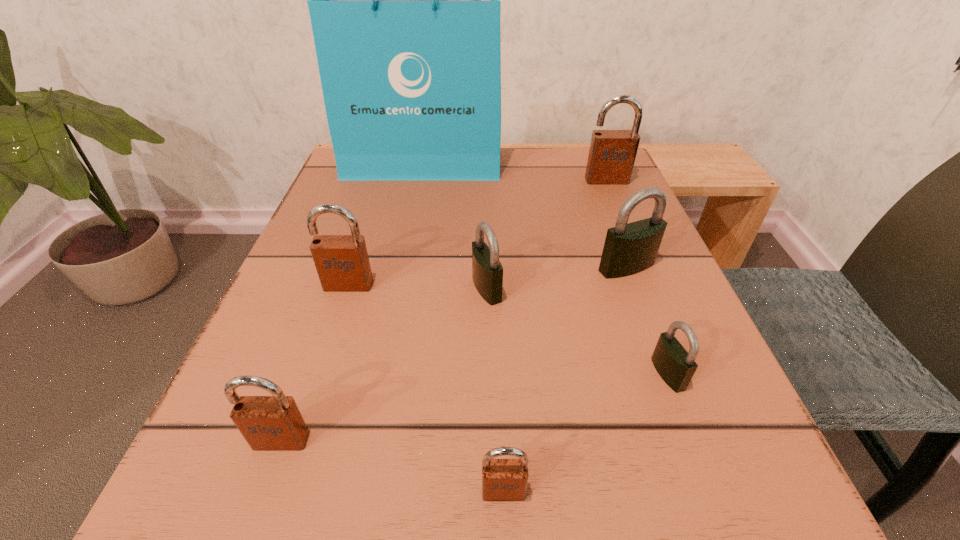
At what (x,y) coordinates should I click in order to perform the action: click on vacant space at the far right corner of the desktop. Please return your answer as a coordinate pair (x, y). Looking at the image, I should click on (563, 169).

In the image, there is a desktop. At what (x,y) coordinates should I click in order to perform the action: click on free space at the near right corner. Please return your answer as a coordinate pair (x, y). The height and width of the screenshot is (540, 960). Looking at the image, I should click on [677, 473].

Find the location of a particular element. vacant region between the nearest object and the seventh farthest object is located at coordinates (393, 465).

I want to click on unoccupied area between the third nearest padlock and the second nearest brown padlock, so click(474, 407).

Where is `blank region between the sixth farthest object and the second farthest brown padlock`? blank region between the sixth farthest object and the second farthest brown padlock is located at coordinates (508, 329).

Find the location of `unoccupied area between the blue shopping bag and the third nearest brown padlock`. unoccupied area between the blue shopping bag and the third nearest brown padlock is located at coordinates (388, 225).

Locate an element on the screen. This screenshot has width=960, height=540. free space between the leftmost black padlock and the second tallest object is located at coordinates (546, 234).

Locate an element on the screen. empty space that is in between the blue shopping bag and the nearest padlock is located at coordinates (465, 328).

Where is `vacant area that lies between the blue shopping bag and the nearest black padlock`? Image resolution: width=960 pixels, height=540 pixels. vacant area that lies between the blue shopping bag and the nearest black padlock is located at coordinates (547, 269).

At what (x,y) coordinates should I click in order to perform the action: click on vacant region between the second smallest black padlock and the sixth farthest padlock. Please return your answer as a coordinate pair (x, y). The image size is (960, 540). Looking at the image, I should click on (384, 364).